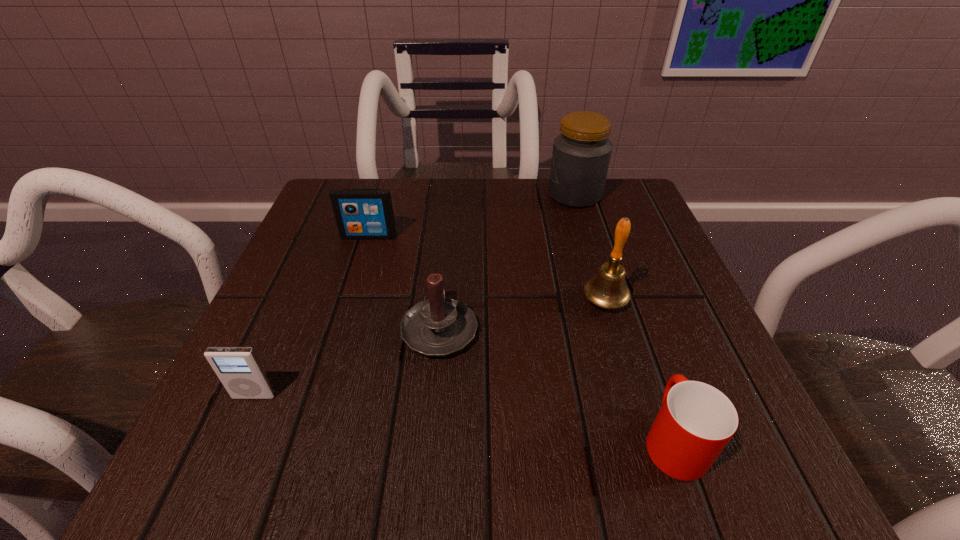
In the image, there is a desktop. Where is `blank space at the near edge`? The image size is (960, 540). blank space at the near edge is located at coordinates (398, 482).

The width and height of the screenshot is (960, 540). I want to click on vacant region at the left edge of the desktop, so click(334, 256).

At what (x,y) coordinates should I click in order to perform the action: click on vacant area at the right edge. Please return your answer as a coordinate pair (x, y). This screenshot has width=960, height=540. Looking at the image, I should click on (x=725, y=367).

In the image, there is a desktop. Where is `free space at the near left corner`? This screenshot has width=960, height=540. free space at the near left corner is located at coordinates (251, 432).

Where is `free area in between the third object from left to right and the second object from left to right`? The width and height of the screenshot is (960, 540). free area in between the third object from left to right and the second object from left to right is located at coordinates (404, 282).

You are a GUI agent. You are given a task and a screenshot of the screen. Output one action in this format:
    pyautogui.click(x=<x>, y=<y>)
    Task: Click on the free area in between the nearest object and the candle
    Image resolution: width=960 pixels, height=540 pixels.
    Given the screenshot: What is the action you would take?
    pyautogui.click(x=557, y=384)

Image resolution: width=960 pixels, height=540 pixels. I want to click on empty location between the second farthest object and the nearest object, so click(521, 338).

Where is `free point between the candle and the left iPod`? free point between the candle and the left iPod is located at coordinates pyautogui.click(x=347, y=362).

Identify the location of vacant point located between the right iPod and the bell. (487, 268).

Find the location of `free spot between the nearest object and the candle`. free spot between the nearest object and the candle is located at coordinates (557, 384).